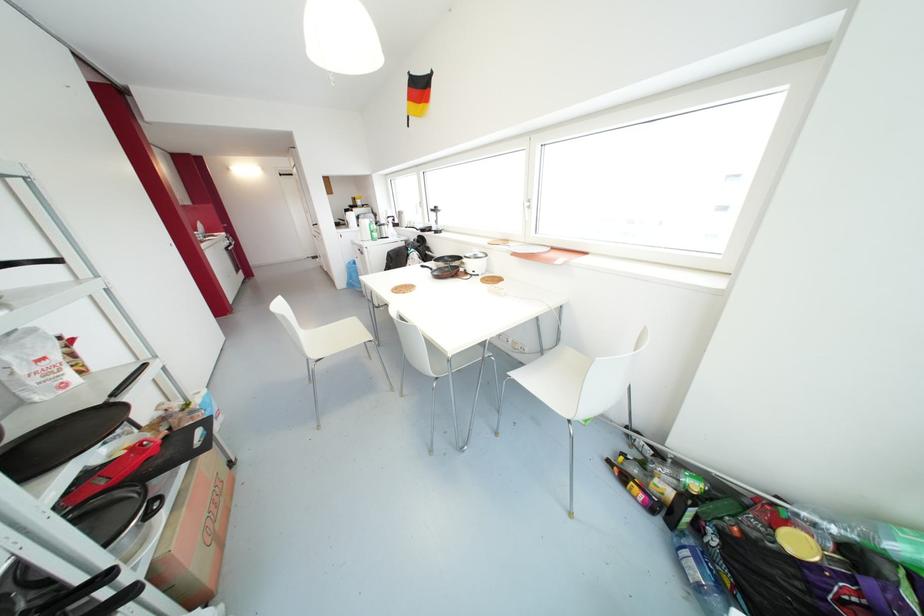
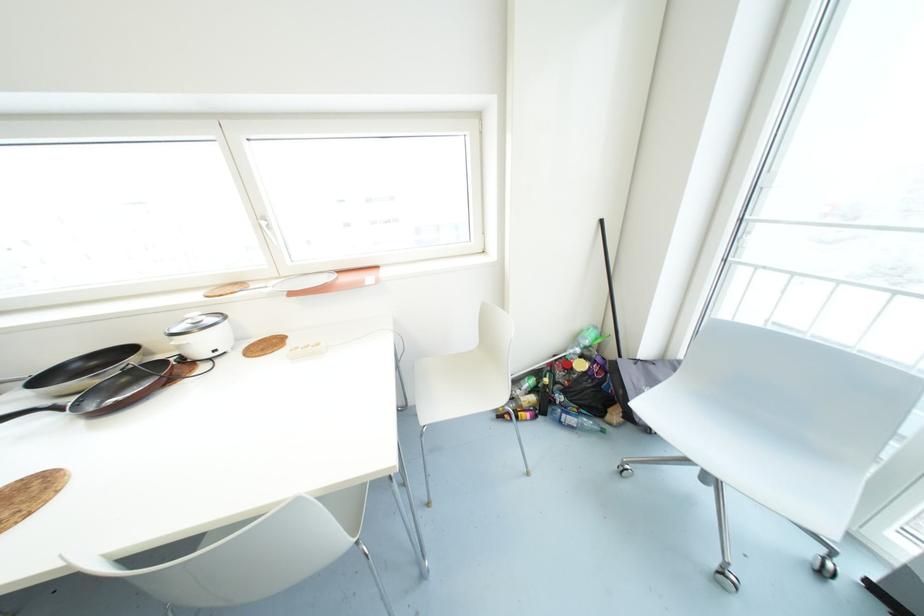
Question: The camera is either moving clockwise (left) or counter-clockwise (right) around the object. The first image is from the beginning of the video and the second image is from the end. Is the camera moving left or right when shooting the video?

Choices:
 (A) Left
 (B) Right

Answer: (A)